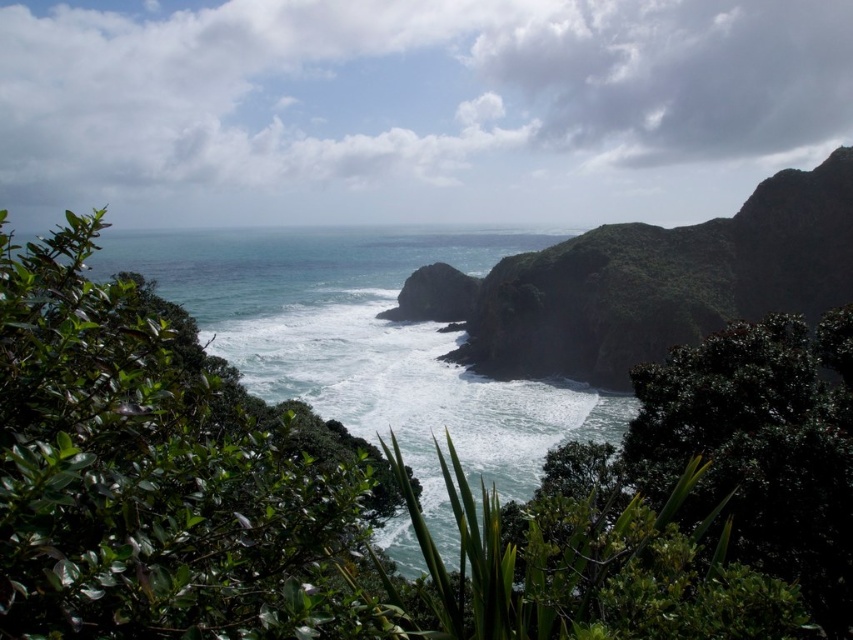
Question: Is greenish-blue water at center positioned before rough rock at center?

Choices:
 (A) yes
 (B) no

Answer: (A)

Question: Can you confirm if greenish-blue water at center is bigger than rough rock at center?

Choices:
 (A) no
 (B) yes

Answer: (B)

Question: Which point appears closest to the camera in this image?

Choices:
 (A) (x=428, y=312)
 (B) (x=281, y=268)

Answer: (A)

Question: Is greenish-blue water at center thinner than rough rock at center?

Choices:
 (A) yes
 (B) no

Answer: (B)